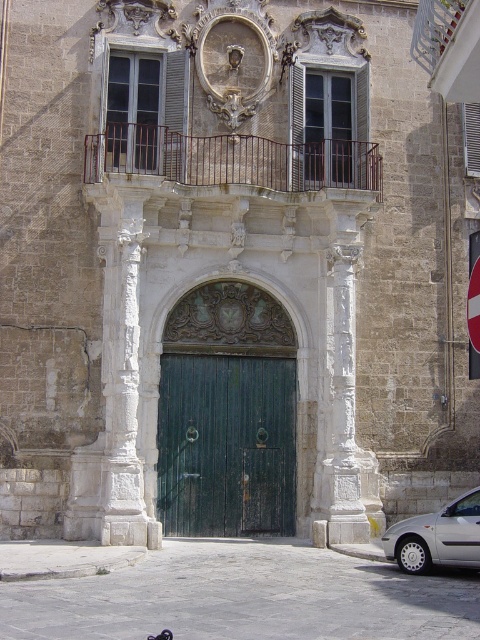
You are a visitor approaching the entrance of this historic building. You see the green wooden door at center and the white plastic sign at upper right. Which object is positioned to the left of the other?

The green wooden door at center is to the left of the white plastic sign at upper right.

You are standing in front of the historic building and want to take a photo of the entrance. To ensure the white stone column at left is centered in your shot, where should you position yourself relative to the column?

To center the white stone column at left in your photo, position yourself directly in front of the column at the point specified by its 2D coordinates, which is at location 0.598 on the x axis and 0.258 on the y axis.

You are standing in front of the historic building and want to determine the relative positions of two points marked on the facade. The first point is at coordinates point (271,374) and the second is at point (474,294). Which point is closer to you?

Point (271,374) is closer to you than point (474,294) because it is further to the viewer according to the description.